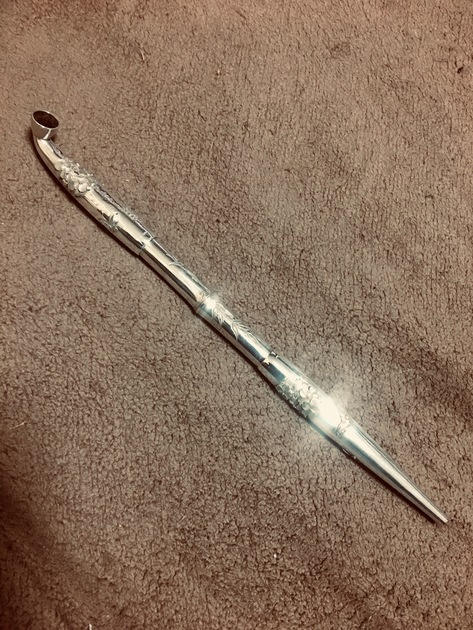
You are a GUI agent. You are given a task and a screenshot of the screen. Output one action in this format:
    pyautogui.click(x=<x>, y=<y>)
    Task: Click on the floor
    
    Given the screenshot: What is the action you would take?
    pyautogui.click(x=339, y=100)